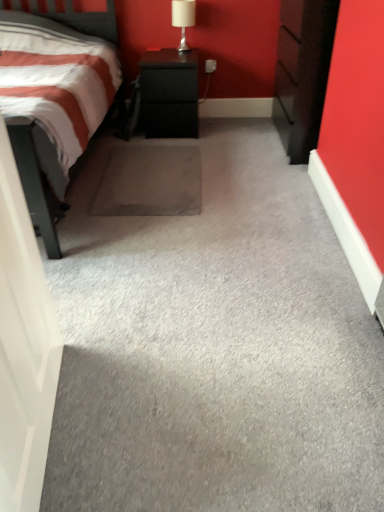
Find the location of a particular element. The image size is (384, 512). free location in front of white glossy table lamp at upper center is located at coordinates (178, 55).